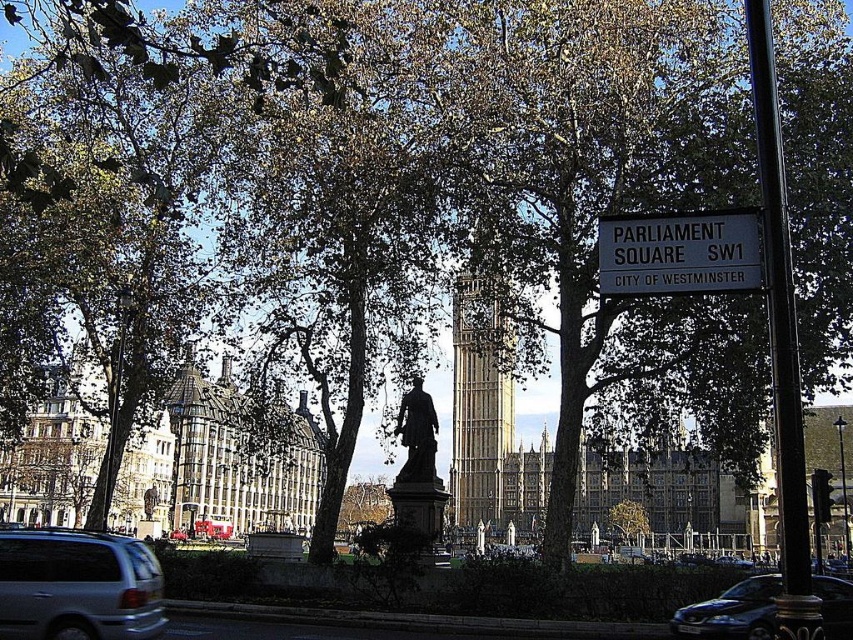
Question: Which point is closer to the camera?

Choices:
 (A) coord(784,308)
 (B) coord(469,516)
 (C) coord(50,580)
 (D) coord(598,268)

Answer: (A)

Question: Is brown stone building at center to the left of white plastic sign at upper center from the viewer's perspective?

Choices:
 (A) no
 (B) yes

Answer: (B)

Question: Among these objects, which one is farthest from the camera?

Choices:
 (A) golden stone clock tower at center
 (B) white plastic sign at upper center
 (C) black metal pole at right

Answer: (A)

Question: Observing the image, what is the correct spatial positioning of white plastic sign at upper center in reference to shiny black car at lower right?

Choices:
 (A) above
 (B) below

Answer: (A)

Question: Is golden stone clock tower at center smaller than shiny black car at lower right?

Choices:
 (A) no
 (B) yes

Answer: (A)

Question: Which object is positioned farthest from the white plastic sign at upper center?

Choices:
 (A) golden stone clock tower at center
 (B) silver metallic van at lower left

Answer: (B)